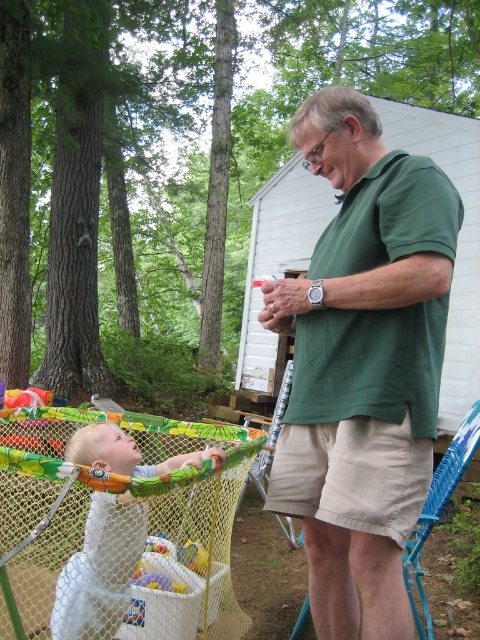
You are a parent trying to choose between two items to place in the baby playpen. You have a green cotton shirt at center and a white mesh baby at center. Which item is bigger in size?

The green cotton shirt at center is larger in size compared to the white mesh baby at center.